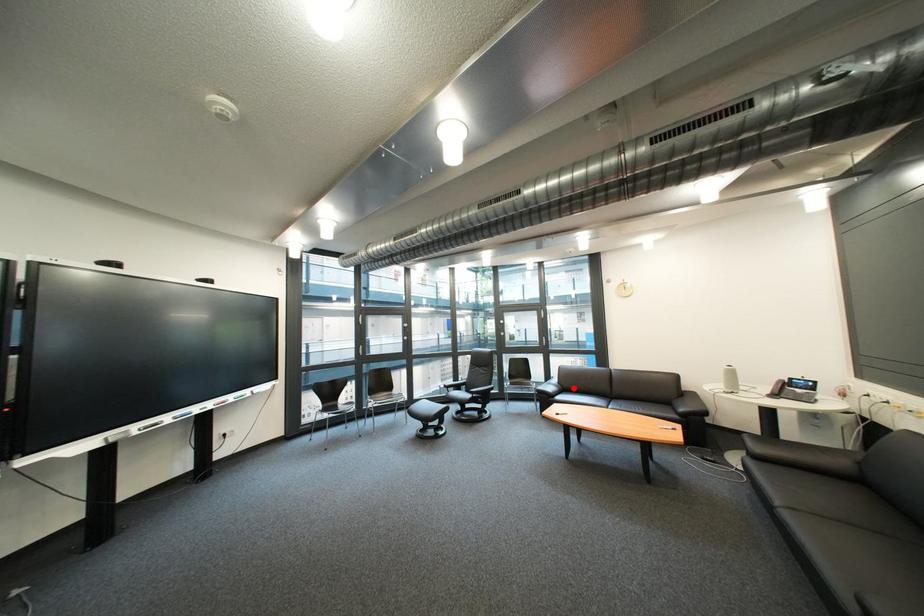
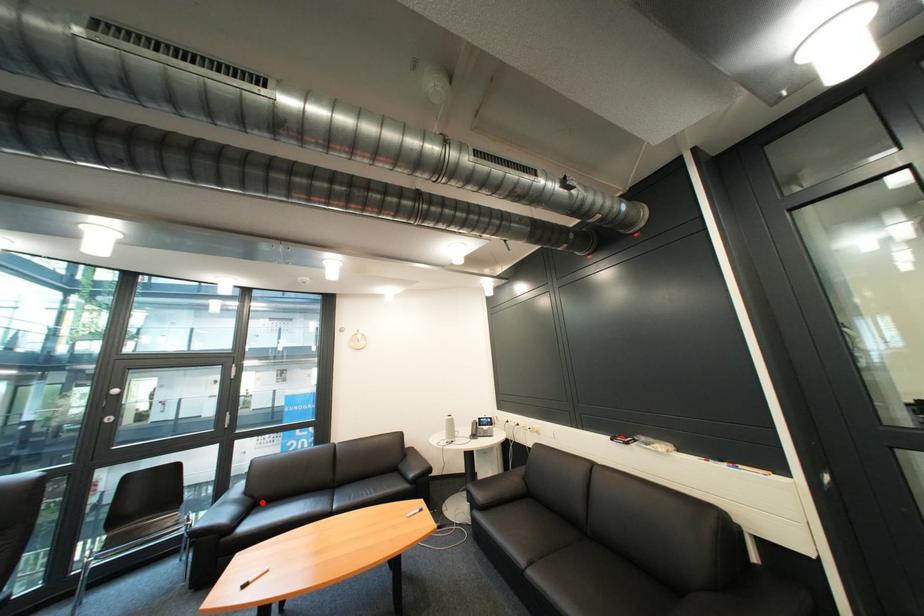
I am providing you with two images of the same scene from different viewpoints. A red point is marked on the first image and another point is marked on the second image. Are the points marked in image1 and image2 representing the same 3D position?

Yes